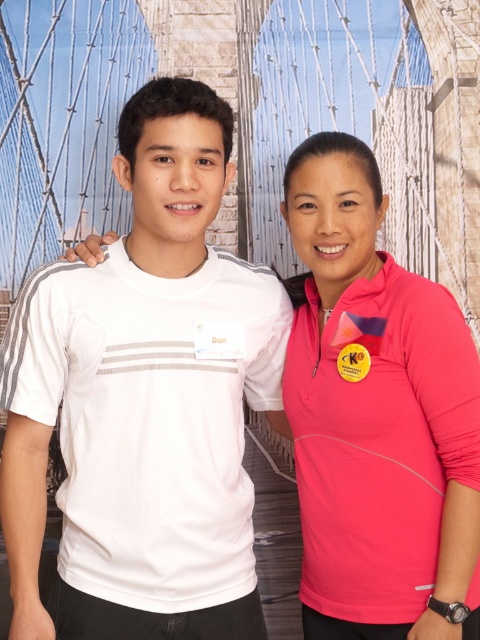
Question: Which point is farther to the camera?

Choices:
 (A) matte white suspension bridge at center
 (B) pink matte/polyester shirt at right

Answer: (A)

Question: Is the position of white matte t-shirt at center more distant than that of pink matte/polyester shirt at right?

Choices:
 (A) no
 (B) yes

Answer: (B)

Question: Does white matte t-shirt at center lie behind pink matte/polyester shirt at right?

Choices:
 (A) no
 (B) yes

Answer: (B)

Question: Estimate the real-world distances between objects in this image. Which object is farther from the white matte t-shirt at center?

Choices:
 (A) matte white suspension bridge at center
 (B) pink matte/polyester shirt at right

Answer: (A)

Question: Which of the following is the closest to the observer?

Choices:
 (A) white matte t-shirt at center
 (B) pink matte/polyester shirt at right
 (C) matte white suspension bridge at center

Answer: (B)

Question: Does matte white suspension bridge at center have a larger size compared to pink matte/polyester shirt at right?

Choices:
 (A) no
 (B) yes

Answer: (A)